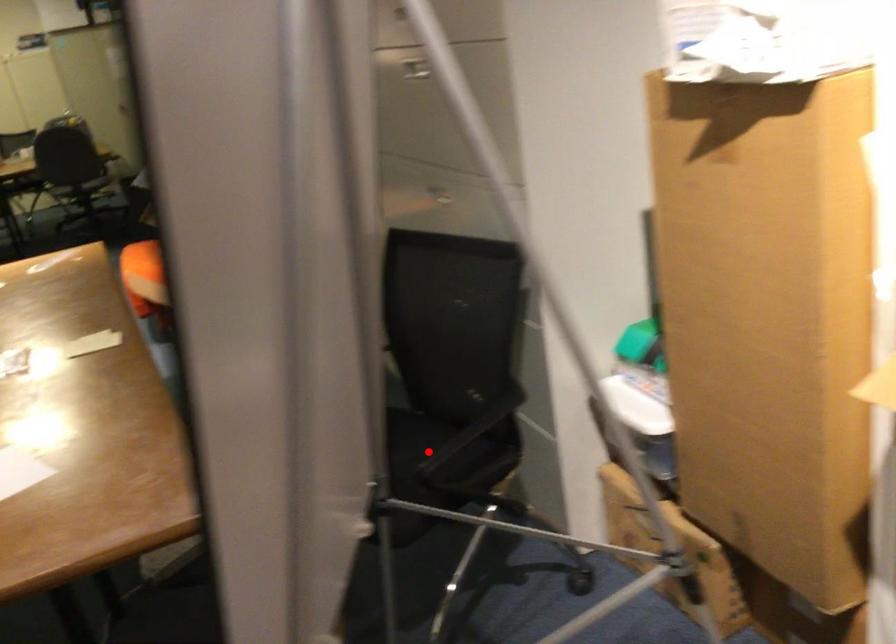
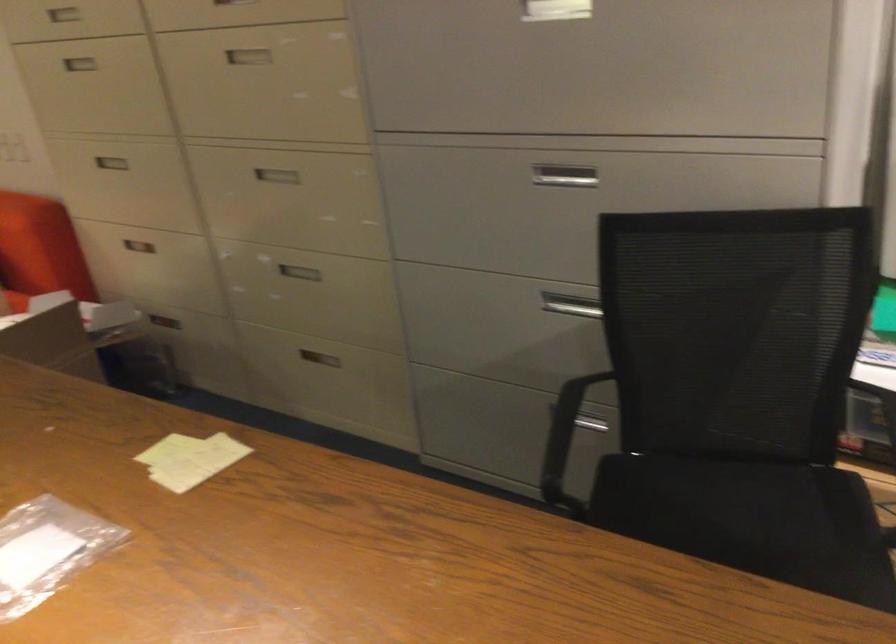
Question: A red point is marked in image1. In image2, is the corresponding 3D point closer to the camera or farther? Reply with the corresponding letter.

Choices:
 (A) The corresponding 3D point is closer.
 (B) The corresponding 3D point is farther.

Answer: (A)